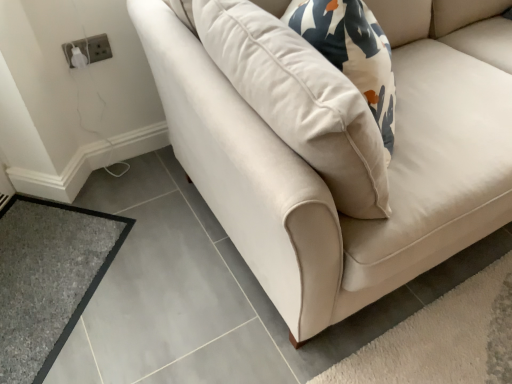
Question: Based on their sizes in the image, would you say gray carpet at lower left is bigger or smaller than white plastic socket at upper left?

Choices:
 (A) small
 (B) big

Answer: (B)

Question: In terms of height, does gray carpet at lower left look taller or shorter compared to white plastic socket at upper left?

Choices:
 (A) short
 (B) tall

Answer: (A)

Question: Looking at their shapes, would you say gray carpet at lower left is wider or thinner than white plastic socket at upper left?

Choices:
 (A) thin
 (B) wide

Answer: (B)

Question: Would you say white plastic socket at upper left is to the left or to the right of gray carpet at lower left in the picture?

Choices:
 (A) right
 (B) left

Answer: (A)

Question: In the image, is white plastic socket at upper left positioned in front of or behind gray carpet at lower left?

Choices:
 (A) front
 (B) behind

Answer: (B)

Question: From a real-world perspective, is white plastic socket at upper left above or below gray carpet at lower left?

Choices:
 (A) above
 (B) below

Answer: (A)

Question: Is point (91, 49) positioned closer to the camera than point (86, 271)?

Choices:
 (A) closer
 (B) farther

Answer: (B)